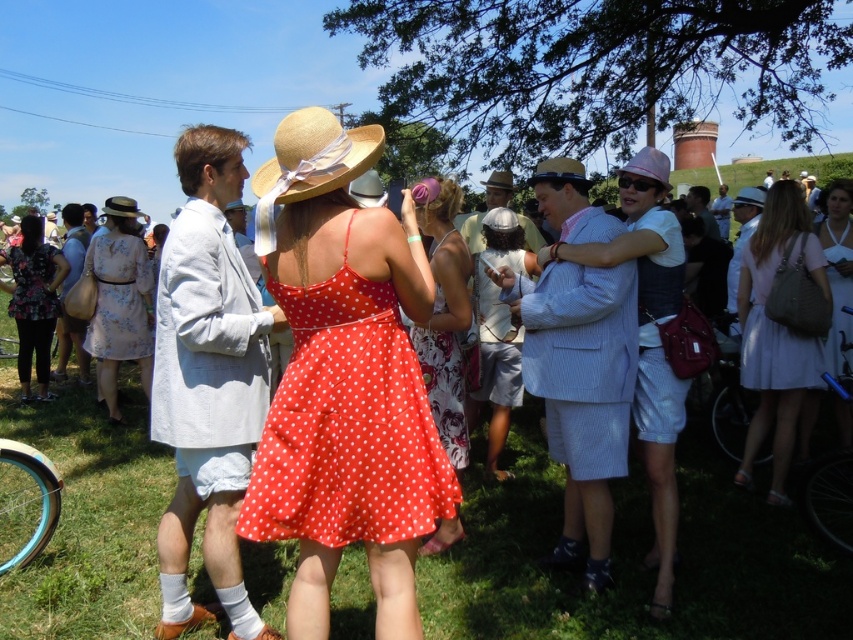
You are a photographer at the event and want to capture a photo that includes both the matte white shorts at center and the white satin dress at lower right. Based on their positions, which object should you place on the left side of your camera frame?

The matte white shorts at center should be placed on the left side of your camera frame because it is positioned on the left side of the white satin dress at lower right.

You are standing at the point labeled point (495, 330) and want to walk to the point labeled point (785, 458). Which direction should you move to get closer to your destination?

To move from point (495, 330) to point (785, 458), you should move forward since point (785, 458) is in front of point (495, 330).